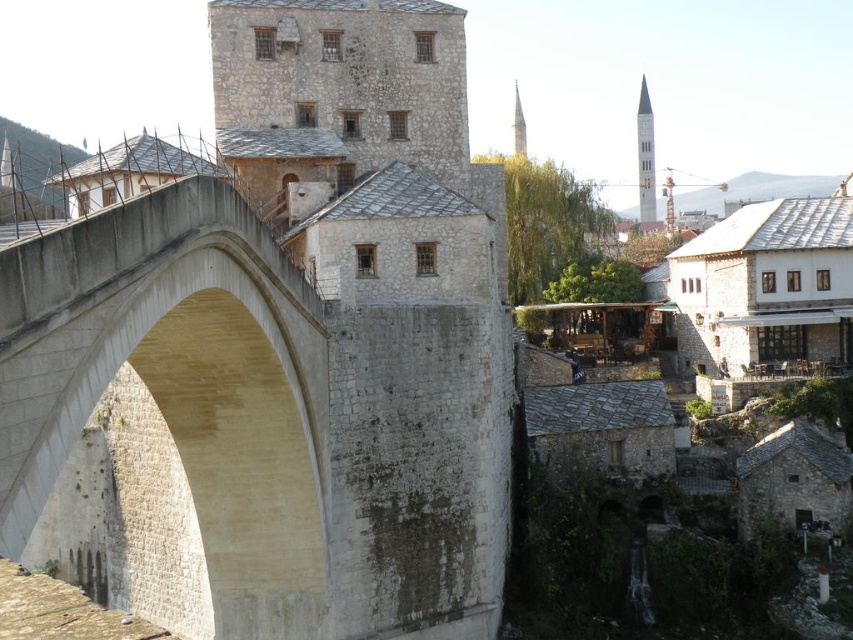
Question: Is beige stone arch bridge at left positioned at the back of smooth white minaret at upper center?

Choices:
 (A) yes
 (B) no

Answer: (B)

Question: In this image, where is beige stone arch bridge at left located relative to smooth white minaret at upper center?

Choices:
 (A) left
 (B) right

Answer: (A)

Question: In this image, where is beige stone arch bridge at left located relative to white stone tower at upper center?

Choices:
 (A) left
 (B) right

Answer: (A)

Question: Among these points, which one is nearest to the camera?

Choices:
 (A) (517, 104)
 (B) (650, 180)
 (C) (300, 378)

Answer: (C)

Question: Which of the following is the farthest from the observer?

Choices:
 (A) tap(323, 401)
 (B) tap(521, 128)

Answer: (B)

Question: Which point is farther to the camera?

Choices:
 (A) (524, 147)
 (B) (248, 273)
 (C) (648, 131)

Answer: (C)